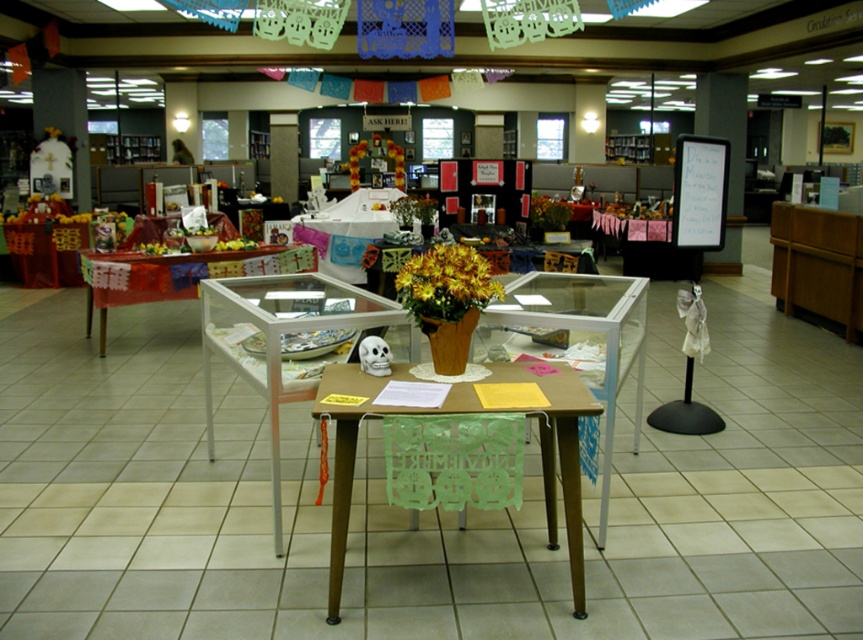
Question: From the image, what is the correct spatial relationship of whiteboard at upper right in relation to yellow matte flower at center?

Choices:
 (A) left
 (B) right

Answer: (B)

Question: Among these objects, which one is farthest from the camera?

Choices:
 (A) whiteboard at upper right
 (B) yellow matte flower at center
 (C) yellow matte flower pot at center

Answer: (B)

Question: Is yellow matte flower pot at center thinner than whiteboard at upper right?

Choices:
 (A) no
 (B) yes

Answer: (B)

Question: Is translucent glass table at center above yellow matte flower at center?

Choices:
 (A) yes
 (B) no

Answer: (B)

Question: Which object is farther from the camera taking this photo?

Choices:
 (A) clear glass table at center
 (B) whiteboard at upper right

Answer: (B)

Question: Which object is the closest to the translucent glass table at center?

Choices:
 (A) brown wooden table at center
 (B) yellow matte flower at center
 (C) clear glass table at center
 (D) yellow matte flower pot at center

Answer: (C)